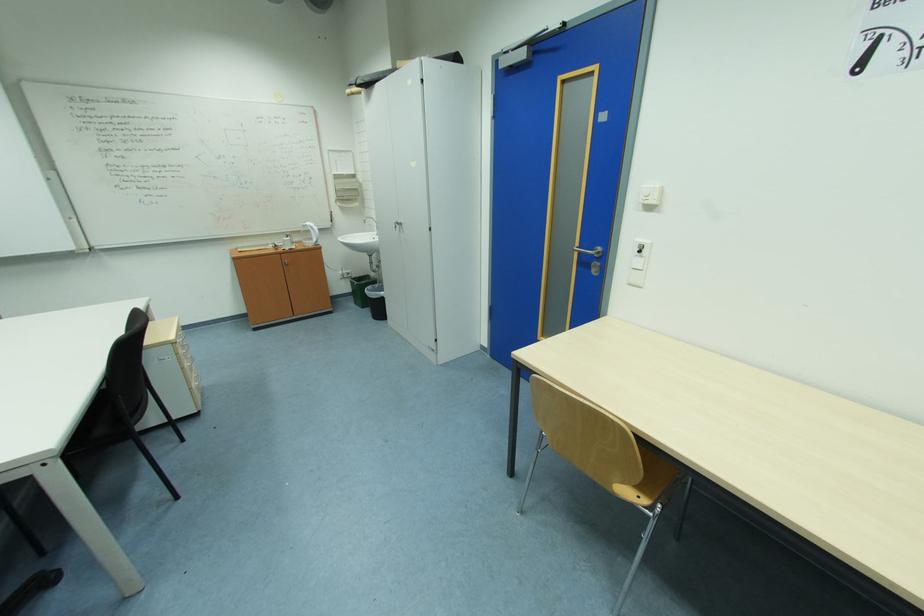
At what (x,y) coordinates should I click in order to perform the action: click on brown cabinet handle. Please return your answer as a coordinate pair (x, y). The height and width of the screenshot is (616, 924). Looking at the image, I should click on (286, 262).